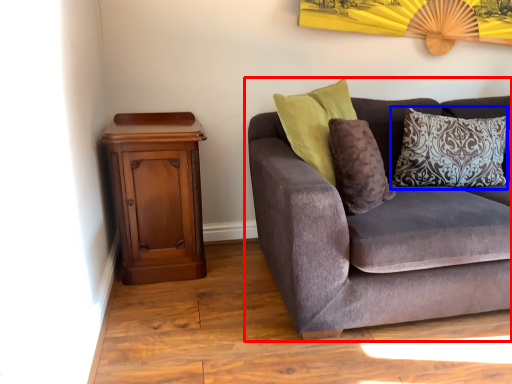
Question: Which object is closer to the camera taking this photo, studio couch (highlighted by a red box) or pillow (highlighted by a blue box)?

Choices:
 (A) studio couch
 (B) pillow

Answer: (A)